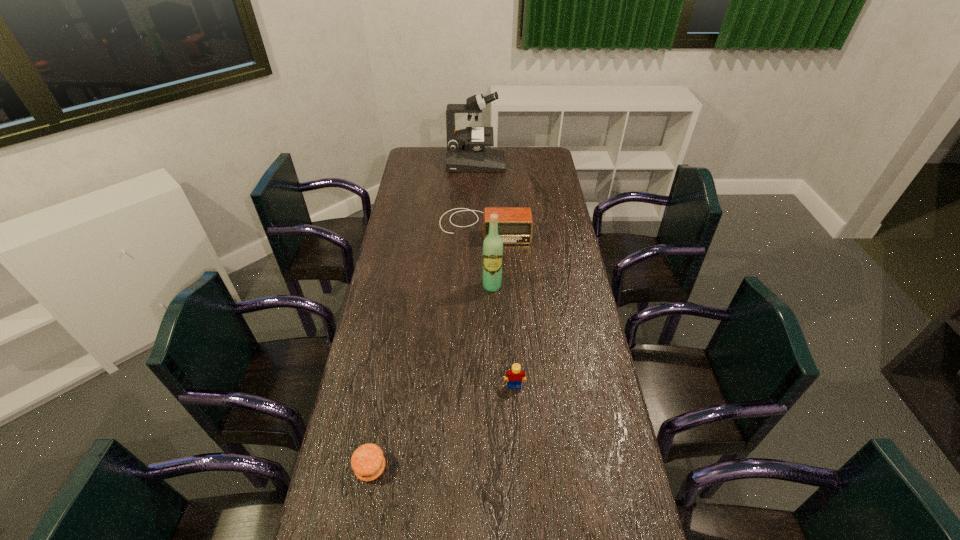
At what (x,y) coordinates should I click in order to perform the action: click on the farthest object. Please return your answer as a coordinate pair (x, y). The image size is (960, 540). Looking at the image, I should click on (465, 152).

The width and height of the screenshot is (960, 540). Identify the location of the third farthest object. (493, 245).

The height and width of the screenshot is (540, 960). What are the coordinates of `the fourth nearest object` in the screenshot? It's located at (515, 225).

Locate an element on the screen. The image size is (960, 540). the second nearest object is located at coordinates (515, 376).

Where is `the leftmost object`? The width and height of the screenshot is (960, 540). the leftmost object is located at coordinates (368, 462).

This screenshot has width=960, height=540. Find the location of `the shortest object`. the shortest object is located at coordinates (368, 462).

Locate an element on the screen. blank area located 0.110m through the eyepieces of the microscope is located at coordinates (525, 164).

At what (x,y) coordinates should I click in order to perform the action: click on free space located 0.120m on the front-facing side of the third farthest object. Please return your answer as a coordinate pair (x, y). Looking at the image, I should click on (492, 316).

Locate an element on the screen. free spot located on the front-facing side of the radio receiver is located at coordinates (485, 267).

Where is `free space located 0.110m on the front-facing side of the Lego`? free space located 0.110m on the front-facing side of the Lego is located at coordinates (516, 422).